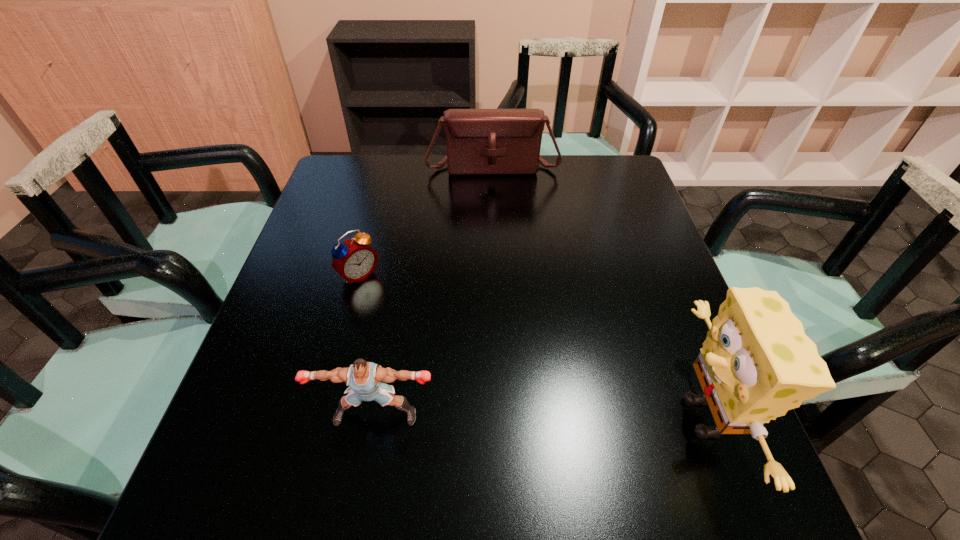
What are the coordinates of `free space between the rightmost object and the farthest object` in the screenshot? It's located at (598, 292).

What are the coordinates of `free space between the shoulder bag and the alarm clock` in the screenshot? It's located at (426, 221).

Image resolution: width=960 pixels, height=540 pixels. Identify the location of free space between the sponge and the shoulder bag. (598, 292).

What are the coordinates of `vacant area between the second shortest object and the sponge` in the screenshot? It's located at (540, 416).

Where is `vacant space that's between the farthest object and the alarm clock`? The image size is (960, 540). vacant space that's between the farthest object and the alarm clock is located at coordinates (426, 221).

Where is `free space between the alarm clock and the tallest object`? This screenshot has height=540, width=960. free space between the alarm clock and the tallest object is located at coordinates (532, 347).

This screenshot has width=960, height=540. I want to click on vacant space in between the shortest object and the farthest object, so click(426, 221).

At what (x,y) coordinates should I click in order to perform the action: click on free space between the farthest object and the rightmost object. Please return your answer as a coordinate pair (x, y). This screenshot has height=540, width=960. Looking at the image, I should click on (598, 292).

What are the coordinates of `unoccupied area between the puncher and the tallest object` in the screenshot? It's located at (540, 416).

You are a GUI agent. You are given a task and a screenshot of the screen. Output one action in this format:
    pyautogui.click(x=<x>, y=<y>)
    Task: Click on the object that ranks as the second closest to the rightmost object
    Image resolution: width=960 pixels, height=540 pixels.
    Given the screenshot: What is the action you would take?
    pos(354,260)